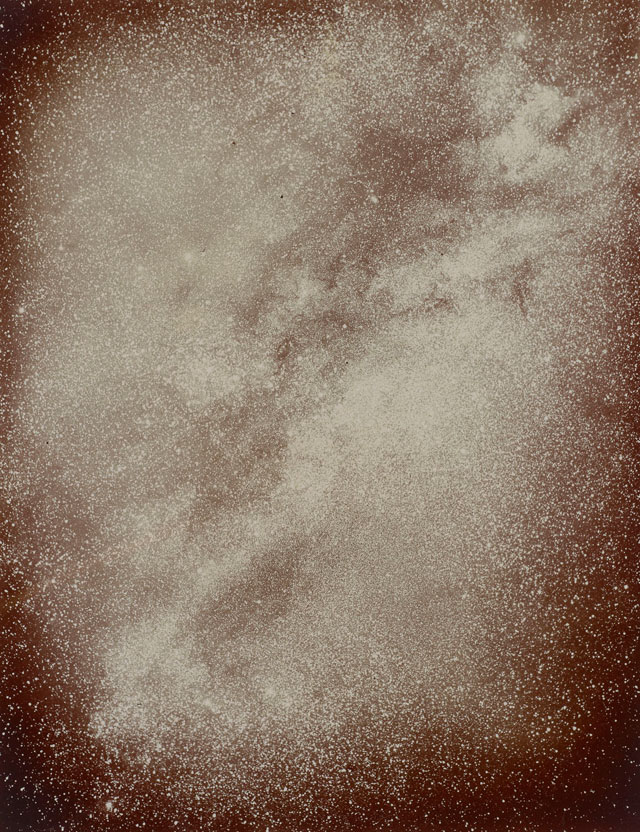
Image resolution: width=640 pixels, height=832 pixels. Identify the location of floor. (x=47, y=765).